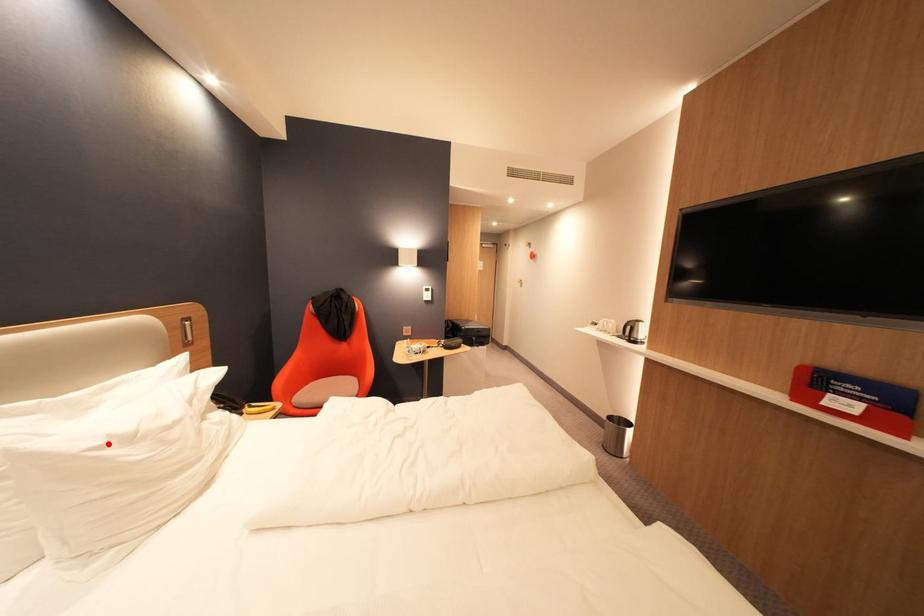
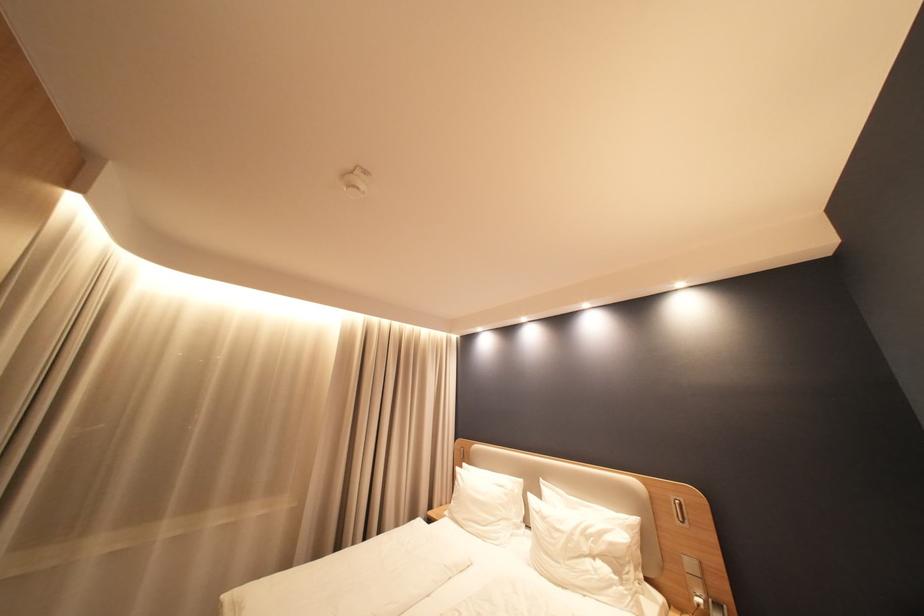
The point at the highlighted location is marked in the first image. Where is the corresponding point in the second image?

(546, 511)